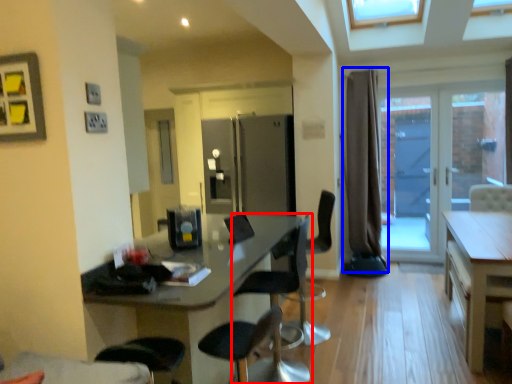
Question: Which object is further to the camera taking this photo, chair (highlighted by a red box) or curtain (highlighted by a blue box)?

Choices:
 (A) chair
 (B) curtain

Answer: (B)